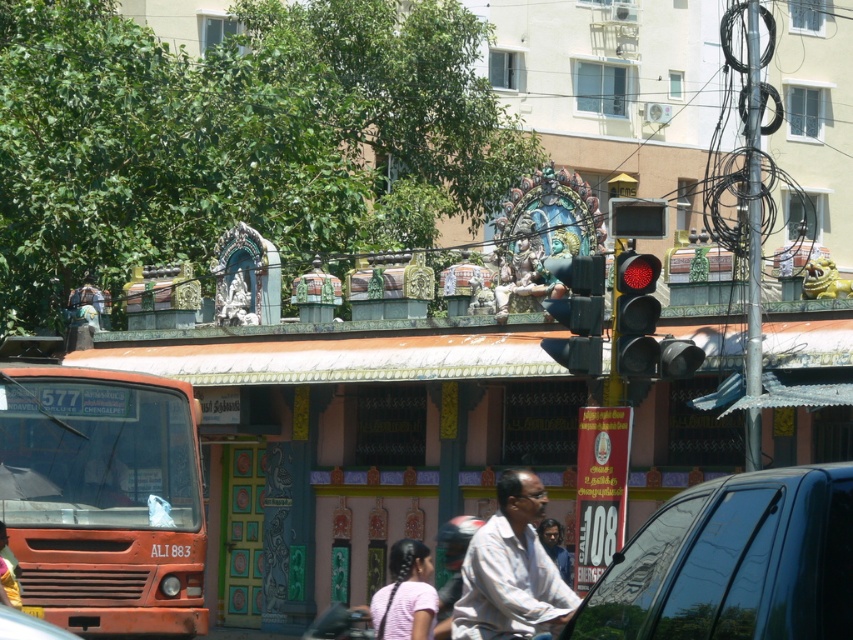
You are a pedestrian standing at the crosswalk in front of the temple. You want to cross the street to reach the bus stop. There is a shiny black car at center and a metallic black traffic light at center. Which object should you look at to determine when it is safe to cross?

You should look at the metallic black traffic light at center to determine when it is safe to cross, as traffic lights control pedestrian crossings and the shiny black car at center is positioned under it, indicating it may be waiting for a signal.

You are a pedestrian standing on the sidewalk and want to cross the street to reach the temple. There is a matte orange bus at left and a white cotton shirt at center in your view. Which object is closer to you as you prepare to cross?

The matte orange bus at left is closer to you than the white cotton shirt at center because it is further to the viewer, meaning it is nearer in your line of sight.

In the scene shown: You are standing at the point marked by coordinates point [103,497] in the image. What object is located at this point?

The point [103,497] corresponds to the matte orange bus at left.